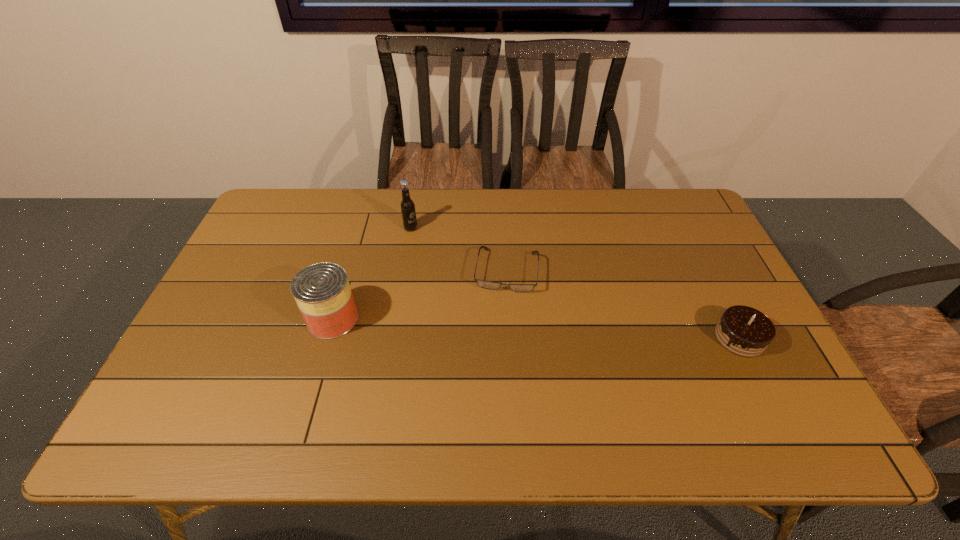
Locate an element on the screen. vacant area that lies between the tallest object and the leftmost object is located at coordinates (372, 273).

Where is `vacant area that lies between the shortest object and the third tallest object`? vacant area that lies between the shortest object and the third tallest object is located at coordinates (623, 304).

I want to click on empty space that is in between the third object from right to left and the third object from left to right, so click(x=459, y=249).

Locate an element on the screen. The height and width of the screenshot is (540, 960). vacant region between the third object from left to right and the farthest object is located at coordinates (459, 249).

This screenshot has width=960, height=540. What are the coordinates of `the second closest object to the farthest object` in the screenshot? It's located at (322, 292).

At what (x,y) coordinates should I click in order to perform the action: click on object that is the nearest to the third shortest object. Please return your answer as a coordinate pair (x, y). Looking at the image, I should click on (407, 206).

Locate an element on the screen. vacant space that satisfies the following two spatial constraints: 1. on the front side of the chocolate cake; 2. on the right side of the second object from right to left is located at coordinates (511, 338).

Where is `vacant space that satisfies the following two spatial constraints: 1. on the back side of the tallest object; 2. on the right side of the second tallest object`? The width and height of the screenshot is (960, 540). vacant space that satisfies the following two spatial constraints: 1. on the back side of the tallest object; 2. on the right side of the second tallest object is located at coordinates (360, 228).